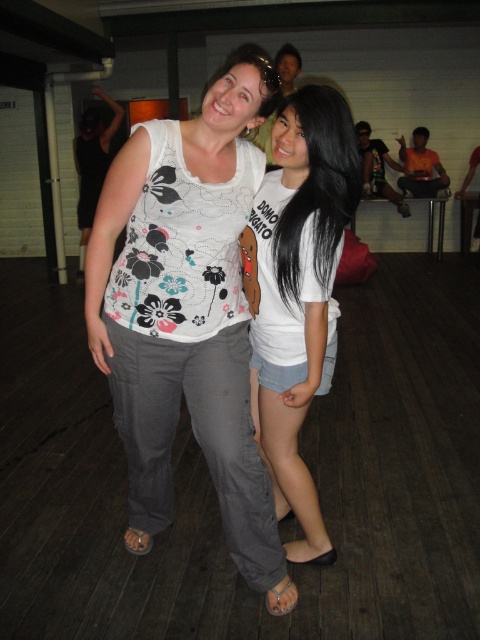
You are standing at the point with coordinates point (330, 212) and want to walk to the point with coordinates point (254, 74). Which direction should you move in to reach your destination?

You should move forward because point (254, 74) is in front of point (330, 212).